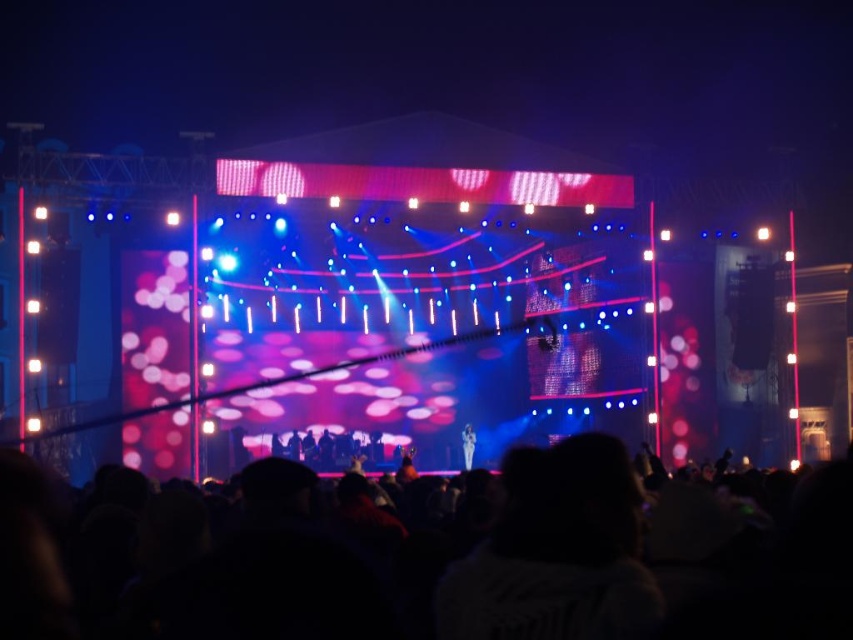
Consider the image. Who is more forward, (650, 625) or (471, 460)?

Point (650, 625)

Locate an element on the screen. The width and height of the screenshot is (853, 640). black matte crowd at lower center is located at coordinates (779, 577).